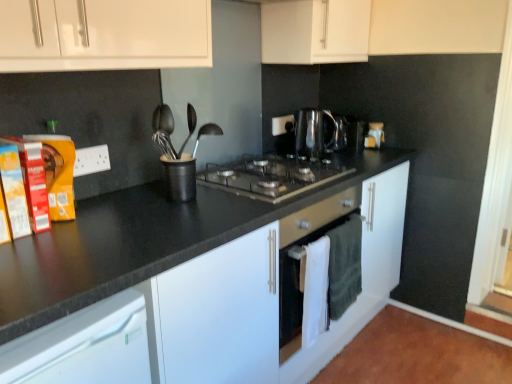
Question: Is shiny metallic kettle at center at the left side of black granite countertop at center?

Choices:
 (A) yes
 (B) no

Answer: (B)

Question: Does shiny metallic kettle at center have a lesser width compared to black granite countertop at center?

Choices:
 (A) yes
 (B) no

Answer: (A)

Question: Is shiny metallic kettle at center taller than black granite countertop at center?

Choices:
 (A) no
 (B) yes

Answer: (A)

Question: From a real-world perspective, is shiny metallic kettle at center positioned over black granite countertop at center based on gravity?

Choices:
 (A) no
 (B) yes

Answer: (B)

Question: From the image's perspective, is shiny metallic kettle at center above black granite countertop at center?

Choices:
 (A) yes
 (B) no

Answer: (A)

Question: Is shiny metallic kettle at center in front of or behind black granite countertop at center in the image?

Choices:
 (A) front
 (B) behind

Answer: (B)

Question: Choose the correct answer: Is shiny metallic kettle at center inside black granite countertop at center or outside it?

Choices:
 (A) inside
 (B) outside

Answer: (B)

Question: From their relative heights in the image, would you say shiny metallic kettle at center is taller or shorter than black granite countertop at center?

Choices:
 (A) tall
 (B) short

Answer: (B)

Question: Considering the positions of point (312, 114) and point (148, 185), is point (312, 114) closer or farther from the camera than point (148, 185)?

Choices:
 (A) farther
 (B) closer

Answer: (A)

Question: Based on their positions, is shiny metallic kettle at center located to the left or right of black matte utensil holder at center?

Choices:
 (A) right
 (B) left

Answer: (A)

Question: Considering the positions of shiny metallic kettle at center and black matte utensil holder at center in the image, is shiny metallic kettle at center wider or thinner than black matte utensil holder at center?

Choices:
 (A) thin
 (B) wide

Answer: (B)

Question: Choose the correct answer: Is shiny metallic kettle at center inside black matte utensil holder at center or outside it?

Choices:
 (A) outside
 (B) inside

Answer: (A)

Question: In terms of size, does shiny metallic kettle at center appear bigger or smaller than black matte utensil holder at center?

Choices:
 (A) small
 (B) big

Answer: (B)

Question: In the image, is black granite countertop at center positioned in front of or behind shiny metallic kettle at center?

Choices:
 (A) front
 (B) behind

Answer: (A)

Question: Considering the positions of black granite countertop at center and shiny metallic kettle at center in the image, is black granite countertop at center wider or thinner than shiny metallic kettle at center?

Choices:
 (A) wide
 (B) thin

Answer: (A)